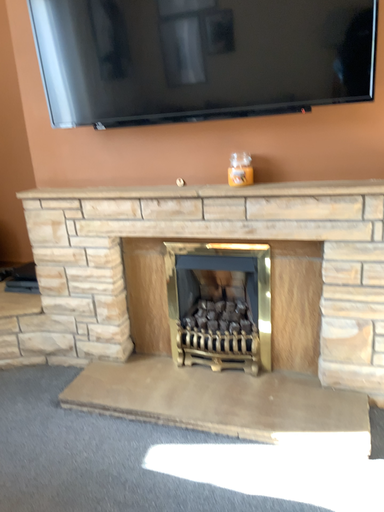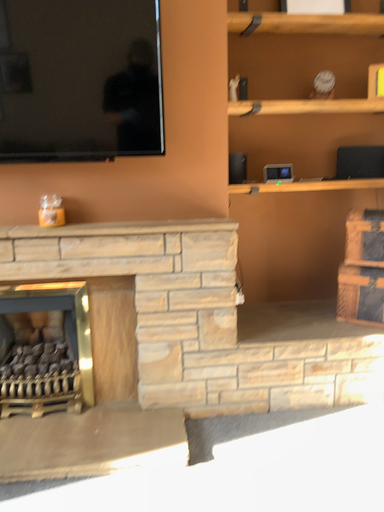
Question: Which way did the camera rotate in the video?

Choices:
 (A) rotated upward
 (B) rotated downward

Answer: (A)